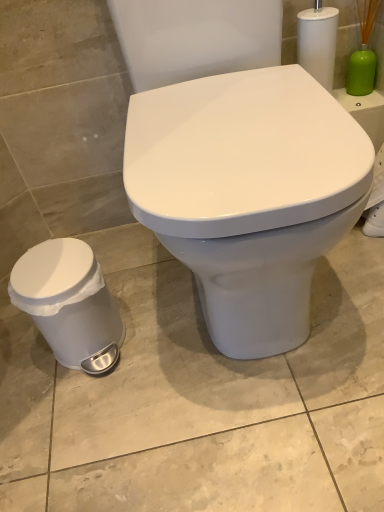
This screenshot has height=512, width=384. What are the coordinates of `free space between white glossy toilet at center and white plastic trash can at lower left` in the screenshot? It's located at (140, 309).